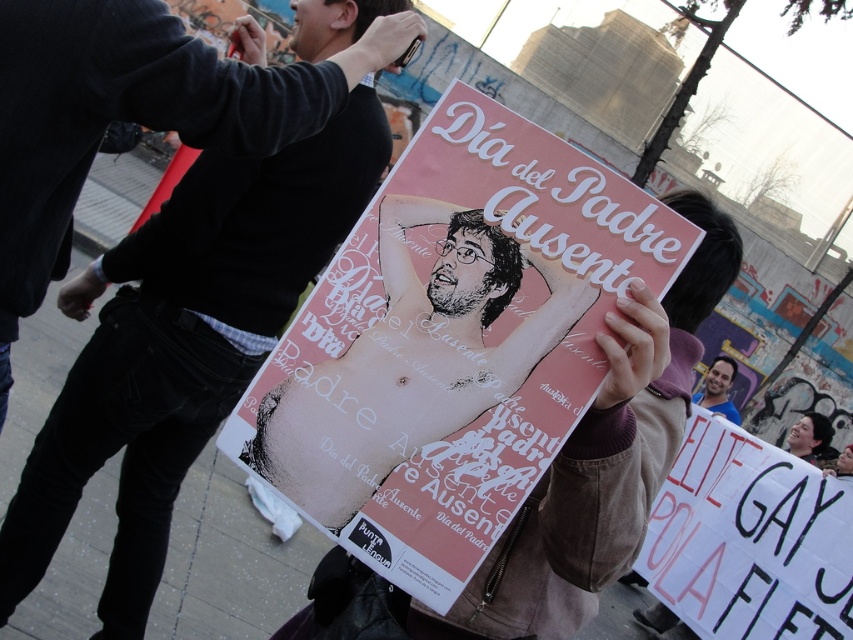
You are a photographer taking a picture of the protest scene. You notice two points in the image at coordinates point (108,570) and point (328,429). Which point is closer to your camera lens?

Point (328,429) is closer to the camera lens because it is less further than point (108,570).